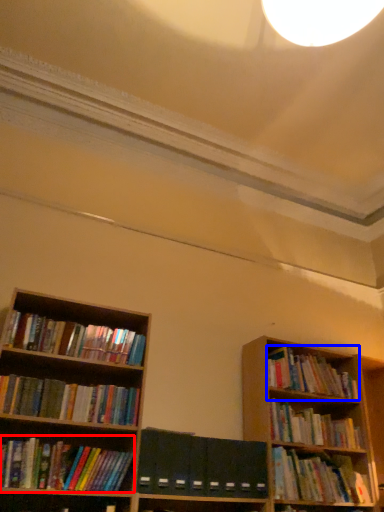
Question: Among these objects, which one is farthest to the camera, book (highlighted by a red box) or book (highlighted by a blue box)?

Choices:
 (A) book
 (B) book

Answer: (B)